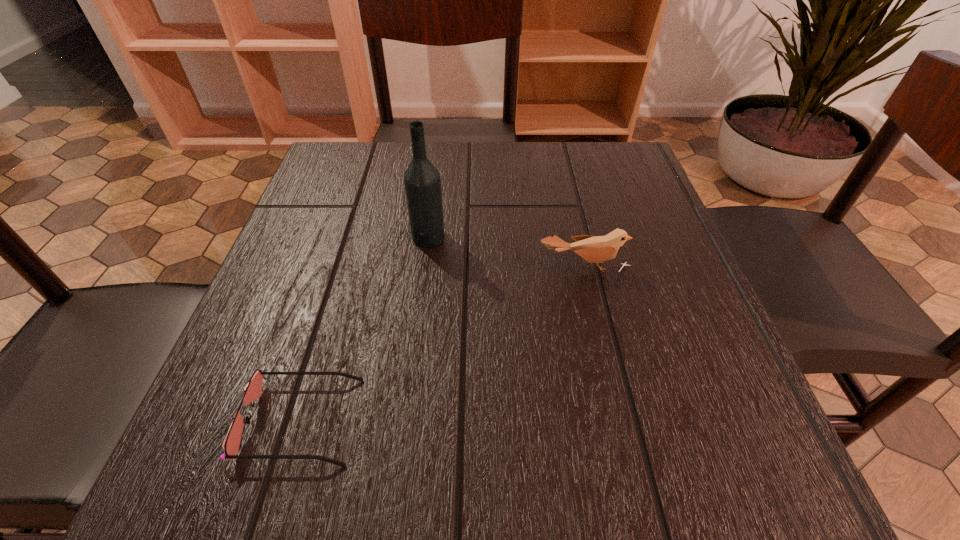
This screenshot has width=960, height=540. Identify the location of object that is the second closest to the tallest object. coord(252,391).

Where is `free location that satisfies the following two spatial constraints: 1. at the beak of the bird; 2. on the bridge of the nearest object`? free location that satisfies the following two spatial constraints: 1. at the beak of the bird; 2. on the bridge of the nearest object is located at coordinates (619, 420).

Identify the location of vacant position in the image that satisfies the following two spatial constraints: 1. at the beak of the bird; 2. on the bridge of the shortest object. (619, 420).

Identify the location of vacant position in the image that satisfies the following two spatial constraints: 1. on the front side of the farthest object; 2. on the bridge of the sunglasses. (406, 420).